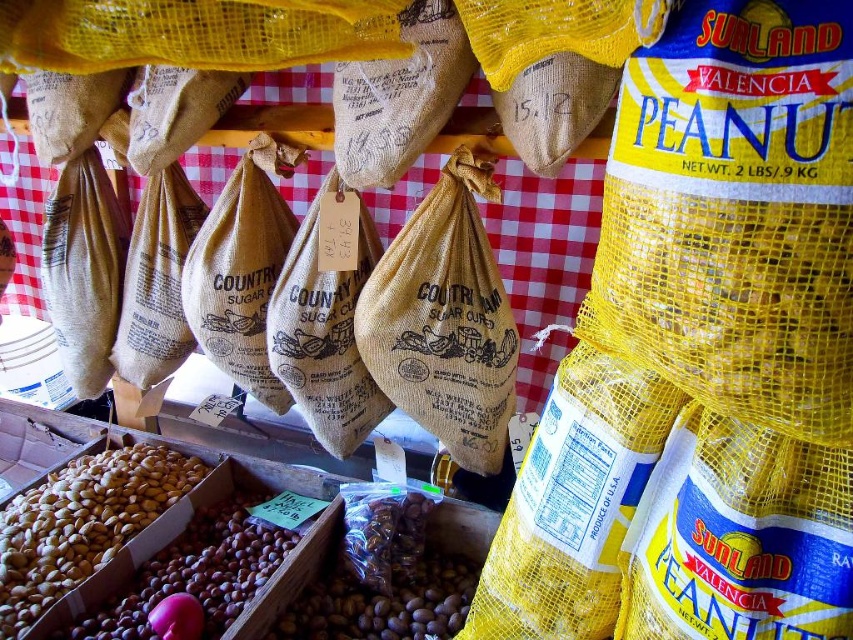
Question: Among these objects, which one is farthest from the camera?

Choices:
 (A) brown matte nuts at center
 (B) brown matte nuts at lower left

Answer: (A)

Question: Can you confirm if brown matte nuts at lower left is wider than brown matte nuts at center?

Choices:
 (A) no
 (B) yes

Answer: (A)

Question: Can you confirm if brown matte nuts at lower left is wider than brown matte nuts at center?

Choices:
 (A) no
 (B) yes

Answer: (A)

Question: Is brown matte nuts at lower left to the right of brown matte nuts at center from the viewer's perspective?

Choices:
 (A) no
 (B) yes

Answer: (A)

Question: Which point is closer to the camera?

Choices:
 (A) brown matte nuts at lower left
 (B) brown matte nuts at center

Answer: (A)